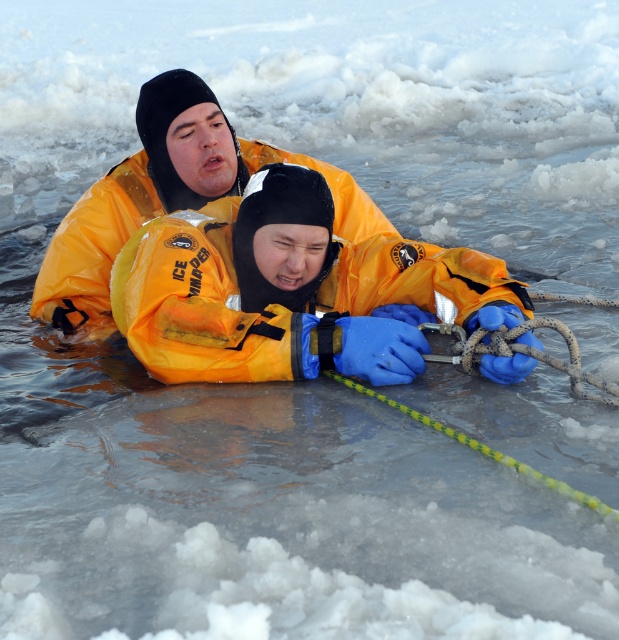
Question: Does orange waterproof jacket at center appear on the left side of yellow matte life jacket at upper center?

Choices:
 (A) yes
 (B) no

Answer: (B)

Question: Can you confirm if orange waterproof jacket at center is positioned above yellow matte life jacket at upper center?

Choices:
 (A) yes
 (B) no

Answer: (B)

Question: Which object appears closest to the camera in this image?

Choices:
 (A) yellow matte life jacket at upper center
 (B) orange waterproof jacket at center

Answer: (B)

Question: Is orange waterproof jacket at center above yellow matte life jacket at upper center?

Choices:
 (A) yes
 (B) no

Answer: (B)